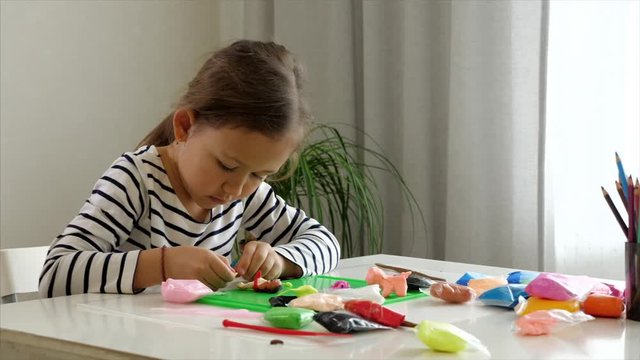
Identify the location of curtains. (425, 54).